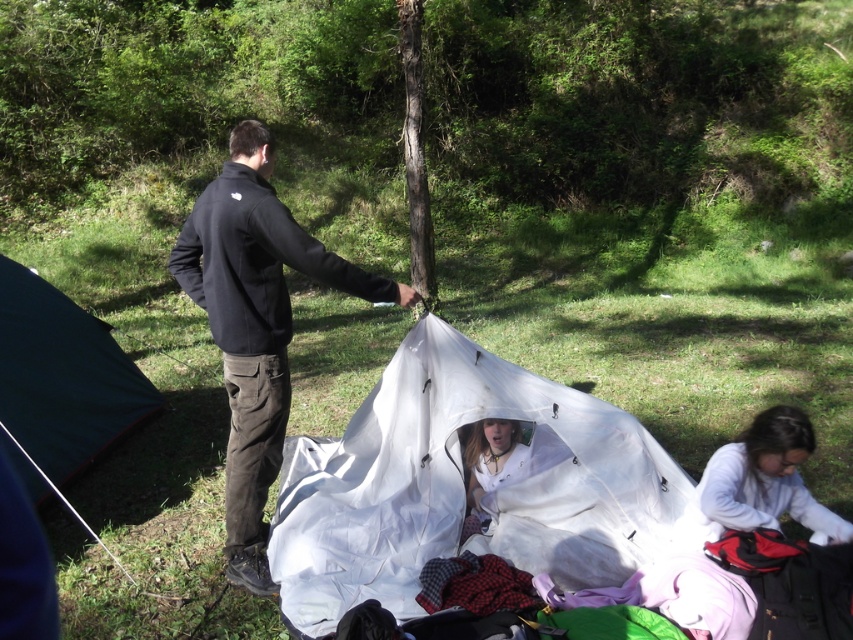
You are a hiker who wants to set up a tent in the camping area shown in the image. There is a point marked at coordinates (463,484). What object is located at this point?

The white nylon tent at center is located at point (463,484).

You are setting up camp in the forest. You have a white nylon tent at center and a dark green tarp at left. Which object is placed on top of the other?

The white nylon tent at center is positioned over the dark green tarp at left.

You are a hiker who just arrived at the campsite. You need to place your backpack, which is 1 foot wide, between the dark green tarp at left and the white matte jacket at lower right. Is there enough space for it?

The distance between the dark green tarp at left and the white matte jacket at lower right is 10.97 feet. Since the backpack is only 1 foot wide, there is sufficient space to place it between them.